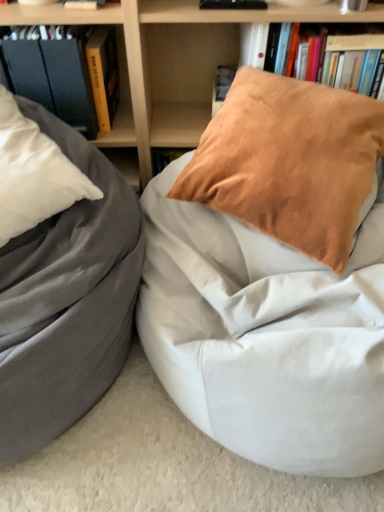
Question: From a real-world perspective, is hardcover book at left physically located above or below matte gray bean bag at left?

Choices:
 (A) above
 (B) below

Answer: (A)

Question: From the image's perspective, is hardcover book at left positioned above or below matte gray bean bag at left?

Choices:
 (A) below
 (B) above

Answer: (B)

Question: Which is farther from the suede orange pillow at upper right?

Choices:
 (A) hardcover book at upper center, placed as the 1th book when sorted from right to left
 (B) matte black book at upper left, acting as the 1th book starting from the left
 (C) white fabric bean bag at center
 (D) wooden bookshelf at upper center
 (E) hardcover book at left

Answer: (E)

Question: Which object is positioned farthest from the yellow hardcover book at upper left, which is the 2th book from left to right?

Choices:
 (A) hardcover book at left
 (B) matte gray bean bag at left
 (C) matte black bookshelf at upper left
 (D) suede orange pillow at upper right
 (E) wooden bookshelf at upper center

Answer: (D)